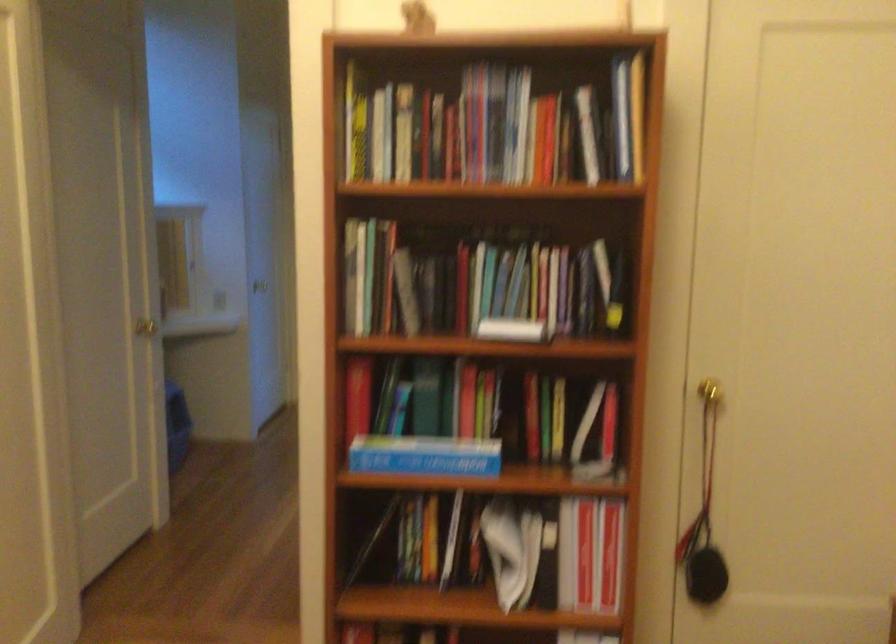
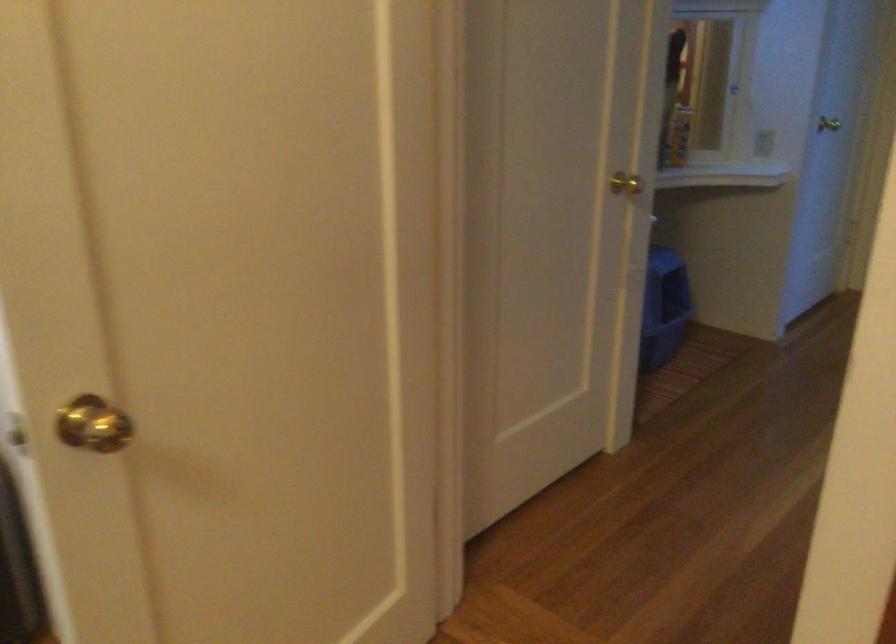
The point at (150, 328) is marked in the first image. Where is the corresponding point in the second image?

(625, 184)